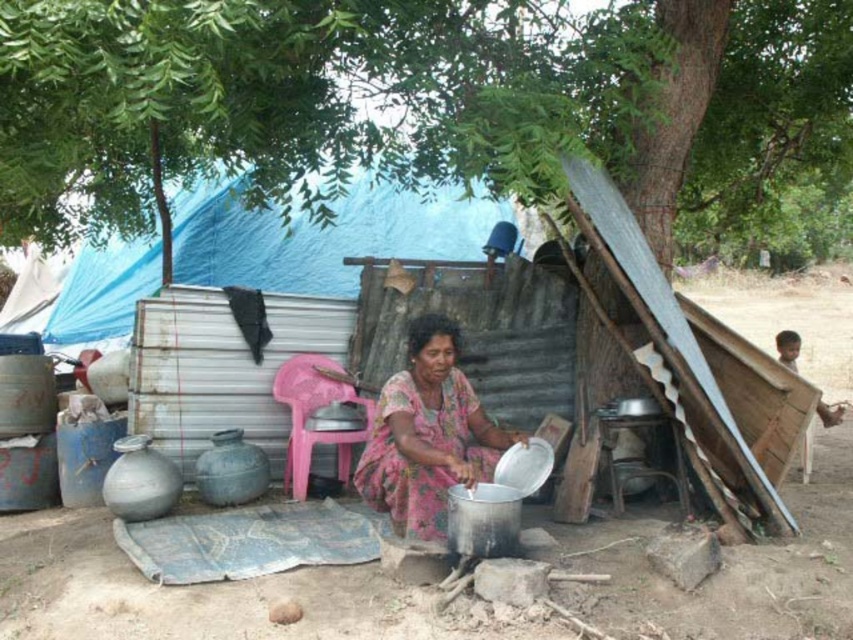
You are a photographer planning to capture the scene of the woman cooking under the blue tarpaulin tent at upper center and wearing the pink fabric dress at center. Since you want to highlight both the tent and the dress, which object should you focus on first considering their sizes?

The blue tarpaulin tent at upper center should be focused on first because it is larger in size compared to the pink fabric dress at center, allowing it to anchor the composition while still leaving space to capture the dress details.

You are planning to set up a campsite in this area and want to choose a spot that offers shade. The green leafy tree at upper left and the blue tarpaulin tent at upper center are both present. Which one provides taller shade coverage?

The blue tarpaulin tent at upper center is taller than the green leafy tree at upper left, so it provides taller shade coverage.

You are a hiker who needs to set up a tent. You have a tent that requires a 5 meter clearance area. Looking at the scene, can you determine if the space between you and the green leafy tree at upper left is sufficient for your tent? Please explain your reasoning.

The space between you and the green leafy tree at upper left is 4.27 meters, which is less than the required 5 meters clearance area. Therefore, the space is insufficient for your tent.